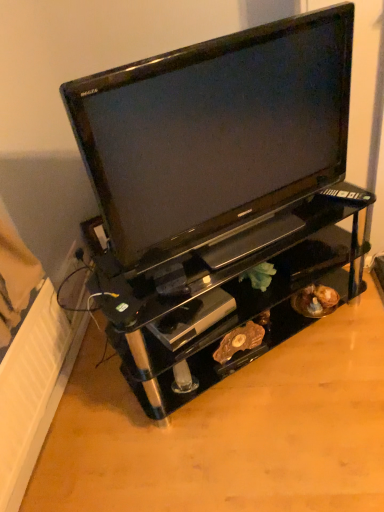
This screenshot has width=384, height=512. What do you see at coordinates (215, 131) in the screenshot? I see `matte black tv at center` at bounding box center [215, 131].

Where is `matte black tv at center`? The image size is (384, 512). matte black tv at center is located at coordinates (215, 131).

Where is `matte black tv at center`? The width and height of the screenshot is (384, 512). matte black tv at center is located at coordinates (215, 131).